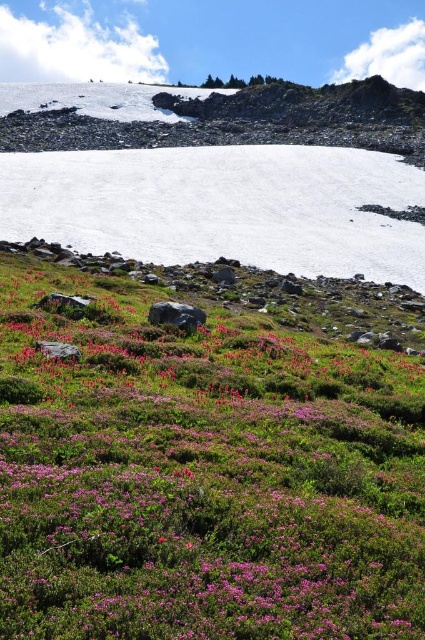
Question: Which of the following is the closest to the observer?

Choices:
 (A) white matte snow at center
 (B) purple leafy grass at lower center

Answer: (B)

Question: Is purple leafy grass at lower center behind white matte snow at center?

Choices:
 (A) yes
 (B) no

Answer: (B)

Question: Is purple leafy grass at lower center closer to camera compared to white matte snow at center?

Choices:
 (A) no
 (B) yes

Answer: (B)

Question: Which point is farther to the camera?

Choices:
 (A) purple leafy grass at lower center
 (B) white matte snow at center

Answer: (B)

Question: Can you confirm if purple leafy grass at lower center is bigger than white matte snow at center?

Choices:
 (A) no
 (B) yes

Answer: (A)